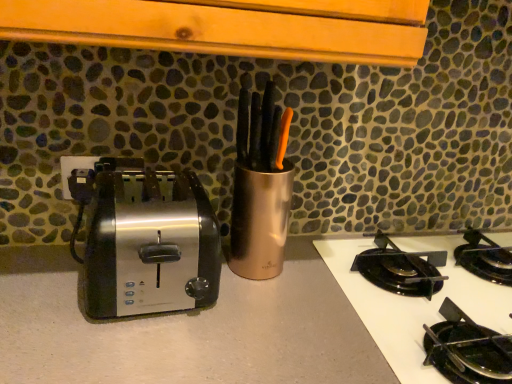
Locate an element on the screen. vacant space to the left of satin metallic toaster at left is located at coordinates (42, 272).